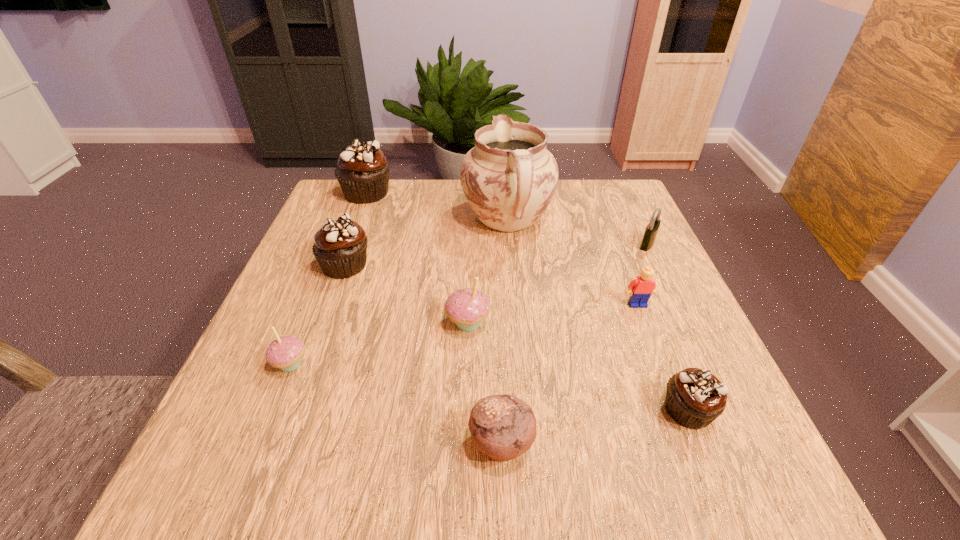
Identify the location of free space that satisfies the following two spatial constraints: 1. on the front side of the muffin; 2. on the right side of the farther pink cupcake. The height and width of the screenshot is (540, 960). (464, 443).

Where is `free spot that satisfies the following two spatial constraints: 1. on the front side of the smallest brown cupcake; 2. on the left side of the seventh farthest object`? This screenshot has height=540, width=960. free spot that satisfies the following two spatial constraints: 1. on the front side of the smallest brown cupcake; 2. on the left side of the seventh farthest object is located at coordinates (272, 410).